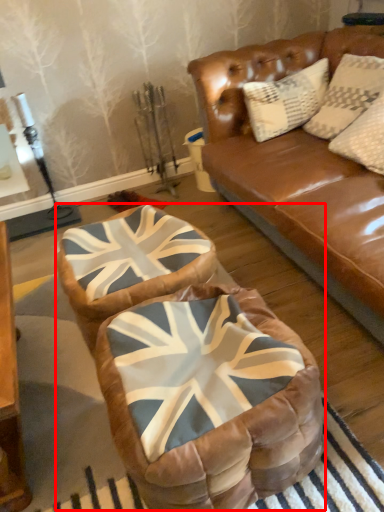
Question: From the image's perspective, where is bean bag chair (annotated by the red box) located relative to swivel chair?

Choices:
 (A) below
 (B) above

Answer: (A)